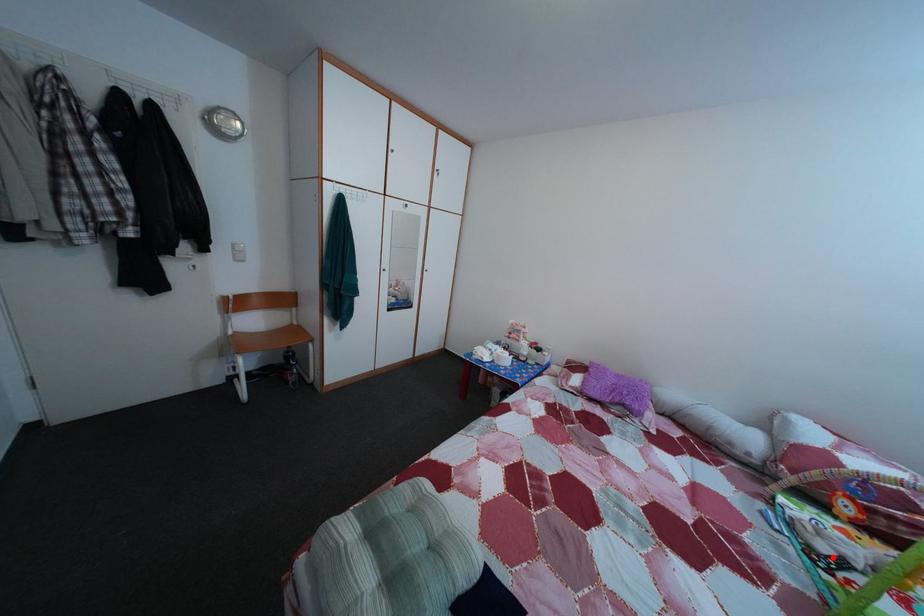
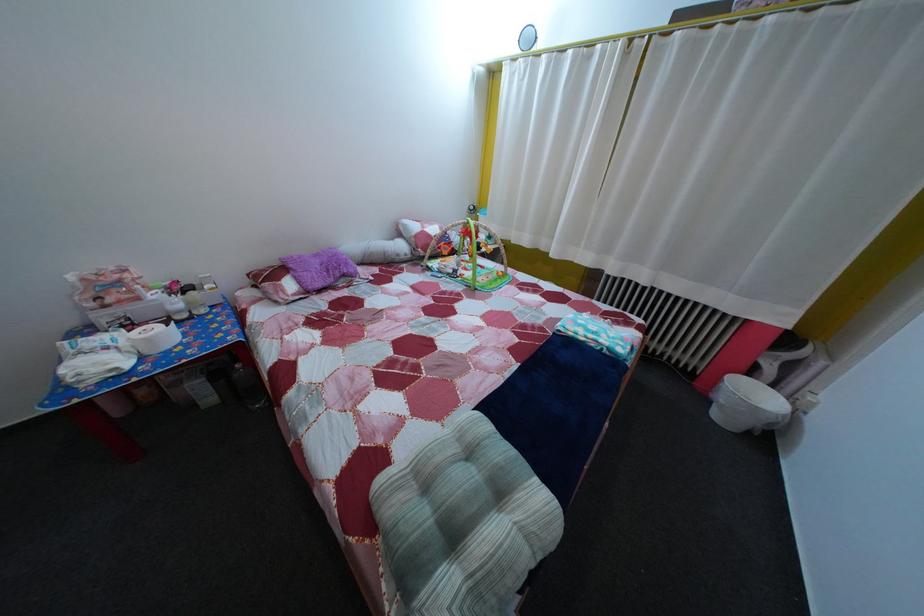
Where in the second image is the point corresponding to the highlighted location from the first image?

(459, 278)